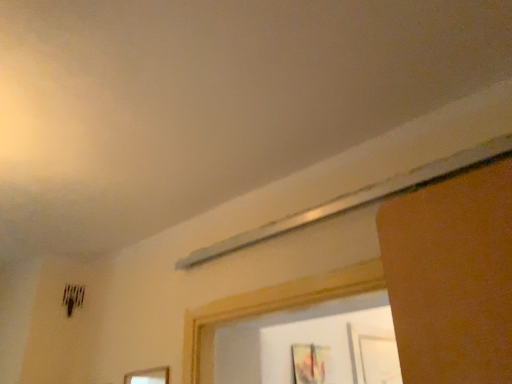
Question: Is point (157, 367) positioned closer to the camera than point (296, 372)?

Choices:
 (A) closer
 (B) farther

Answer: (A)

Question: Considering the positions of wooden picture frame at lower center, the 1th picture frame viewed from the left, and matte wooden picture frame at lower right, acting as the 1th picture frame starting from the right, in the image, is wooden picture frame at lower center, the 1th picture frame viewed from the left, taller or shorter than matte wooden picture frame at lower right, acting as the 1th picture frame starting from the right,?

Choices:
 (A) short
 (B) tall

Answer: (A)

Question: Choose the correct answer: Is wooden picture frame at lower center, the 1th picture frame in the front-to-back sequence, inside matte wooden picture frame at lower right, the second picture frame from the left, or outside it?

Choices:
 (A) outside
 (B) inside

Answer: (A)

Question: From the image's perspective, is matte wooden picture frame at lower right, the second picture frame from the left, located above or below wooden picture frame at lower center, the 1th picture frame viewed from the left?

Choices:
 (A) above
 (B) below

Answer: (B)

Question: Is matte wooden picture frame at lower right, placed as the second picture frame when sorted from front to back, to the left or to the right of wooden picture frame at lower center, which is the second picture frame in right-to-left order, in the image?

Choices:
 (A) left
 (B) right

Answer: (B)

Question: Is matte wooden picture frame at lower right, placed as the second picture frame when sorted from front to back, in front of or behind wooden picture frame at lower center, arranged as the 2th picture frame when viewed from the back, in the image?

Choices:
 (A) front
 (B) behind

Answer: (B)

Question: Is matte wooden picture frame at lower right, which is counted as the first picture frame, starting from the back, wider or thinner than wooden picture frame at lower center, which is the second picture frame in right-to-left order?

Choices:
 (A) thin
 (B) wide

Answer: (B)